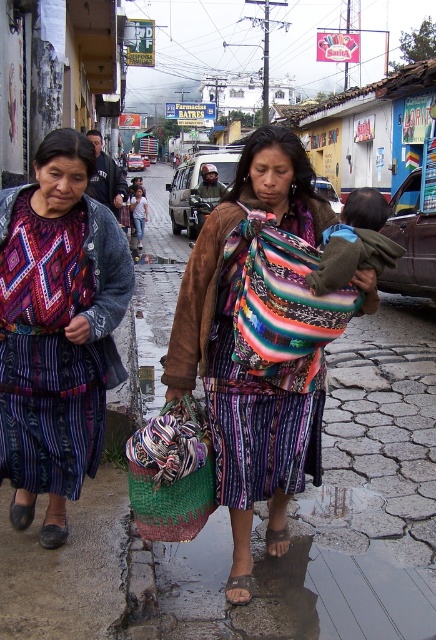
Does matte black jacket at left appear on the right side of braided straw bag at lower center?

In fact, matte black jacket at left is to the left of braided straw bag at lower center.

Is matte black jacket at left bigger than braided straw bag at lower center?

Yes, matte black jacket at left is bigger than braided straw bag at lower center.

What do you see at coordinates (57, 330) in the screenshot? The height and width of the screenshot is (640, 436). I see `matte black jacket at left` at bounding box center [57, 330].

Identify the location of matte black jacket at left. This screenshot has width=436, height=640. 57,330.

Between multicolored woven shawl at center and matte black jacket at left, which one appears on the left side from the viewer's perspective?

matte black jacket at left is more to the left.

Is multicolored woven shawl at center bigger than matte black jacket at left?

Indeed, multicolored woven shawl at center has a larger size compared to matte black jacket at left.

Who is more distant from viewer, (286, 259) or (46, 179)?

Positioned behind is point (46, 179).

The width and height of the screenshot is (436, 640). In order to click on multicolored woven shawl at center in this screenshot , I will do `click(261, 337)`.

Consider the image. Which is above, multicolored woven shawl at center or braided straw bag at lower center?

multicolored woven shawl at center

Does multicolored woven shawl at center appear under braided straw bag at lower center?

No.

Is point (220, 486) farther from camera compared to point (149, 525)?

Yes, it is.

Image resolution: width=436 pixels, height=640 pixels. I want to click on multicolored woven shawl at center, so click(261, 337).